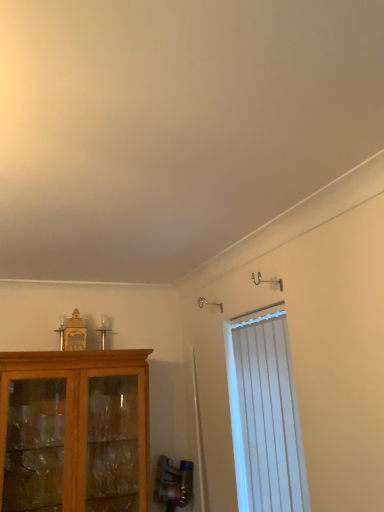
Question: Would you say white vertical blinds at right is outside matte wood cabinet at left?

Choices:
 (A) yes
 (B) no

Answer: (A)

Question: Is the depth of white vertical blinds at right greater than that of matte wood cabinet at left?

Choices:
 (A) yes
 (B) no

Answer: (B)

Question: Does white vertical blinds at right have a larger size compared to matte wood cabinet at left?

Choices:
 (A) no
 (B) yes

Answer: (A)

Question: Does white vertical blinds at right have a greater width compared to matte wood cabinet at left?

Choices:
 (A) no
 (B) yes

Answer: (A)

Question: Is there a large distance between white vertical blinds at right and matte wood cabinet at left?

Choices:
 (A) yes
 (B) no

Answer: (B)

Question: Does white vertical blinds at right have a lesser width compared to matte wood cabinet at left?

Choices:
 (A) no
 (B) yes

Answer: (B)

Question: From a real-world perspective, is matte wood cabinet at left located higher than white vertical blinds at right?

Choices:
 (A) no
 (B) yes

Answer: (A)

Question: Could you tell me if matte wood cabinet at left is facing white vertical blinds at right?

Choices:
 (A) yes
 (B) no

Answer: (B)

Question: Is matte wood cabinet at left to the right of white vertical blinds at right from the viewer's perspective?

Choices:
 (A) yes
 (B) no

Answer: (B)

Question: Considering the relative positions of matte wood cabinet at left and white vertical blinds at right in the image provided, is matte wood cabinet at left to the left of white vertical blinds at right from the viewer's perspective?

Choices:
 (A) yes
 (B) no

Answer: (A)

Question: From the image's perspective, would you say matte wood cabinet at left is shown under white vertical blinds at right?

Choices:
 (A) no
 (B) yes

Answer: (B)

Question: Is matte wood cabinet at left wider than white vertical blinds at right?

Choices:
 (A) yes
 (B) no

Answer: (A)

Question: In terms of height, does matte wood cabinet at left look taller or shorter compared to white vertical blinds at right?

Choices:
 (A) tall
 (B) short

Answer: (B)